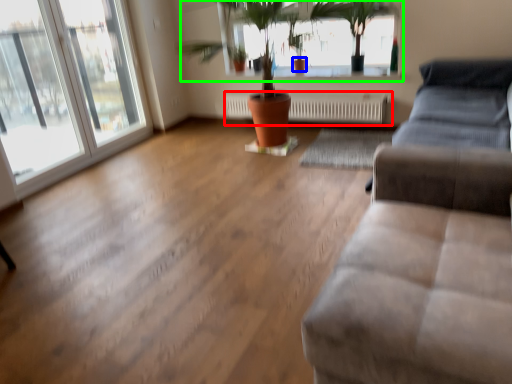
Question: Considering the real-world distances, which object is farthest from radiator (highlighted by a red box)? flowerpot (highlighted by a blue box) or bay window (highlighted by a green box)?

Choices:
 (A) flowerpot
 (B) bay window

Answer: (A)